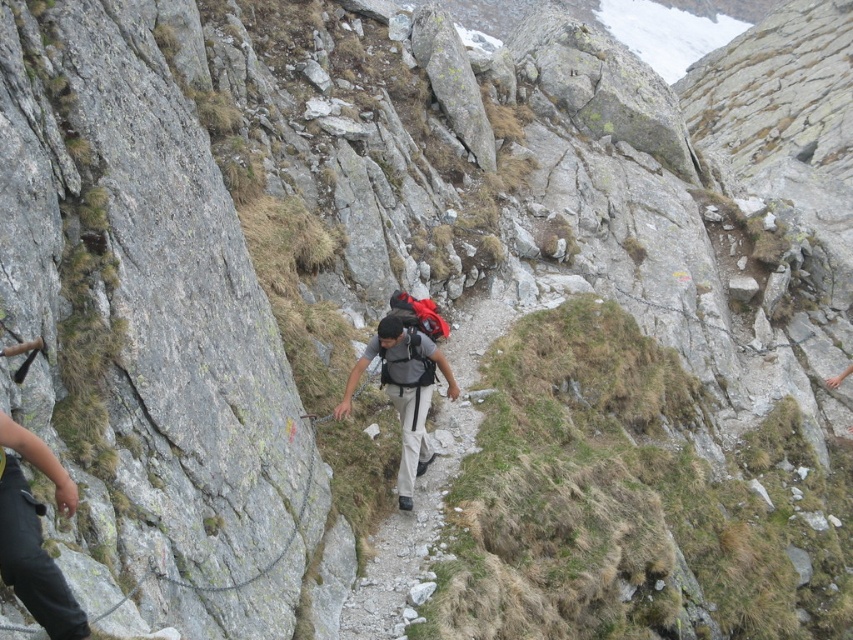
Question: Can you confirm if green grassy slope at center is bigger than matte gray backpack at center?

Choices:
 (A) no
 (B) yes

Answer: (B)

Question: Can you confirm if green grassy slope at center is positioned below matte gray backpack at center?

Choices:
 (A) no
 (B) yes

Answer: (B)

Question: Is green grassy slope at center to the left of matte gray backpack at center from the viewer's perspective?

Choices:
 (A) yes
 (B) no

Answer: (B)

Question: Among these points, which one is farthest from the camera?

Choices:
 (A) (836, 458)
 (B) (380, 323)

Answer: (A)

Question: Which object appears farthest from the camera in this image?

Choices:
 (A) green grassy slope at center
 (B) matte gray backpack at center

Answer: (B)